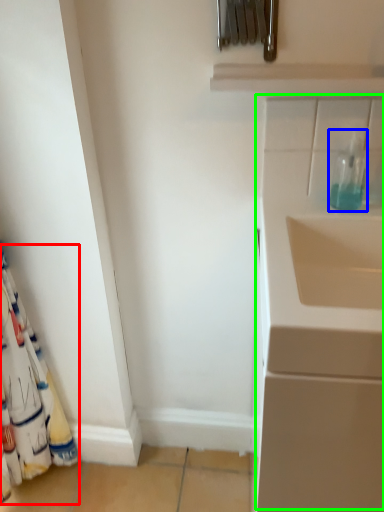
Question: Considering the real-world distances, which object is farthest from curtain (highlighted by a red box)? bottle (highlighted by a blue box) or wide (highlighted by a green box)?

Choices:
 (A) bottle
 (B) wide

Answer: (A)